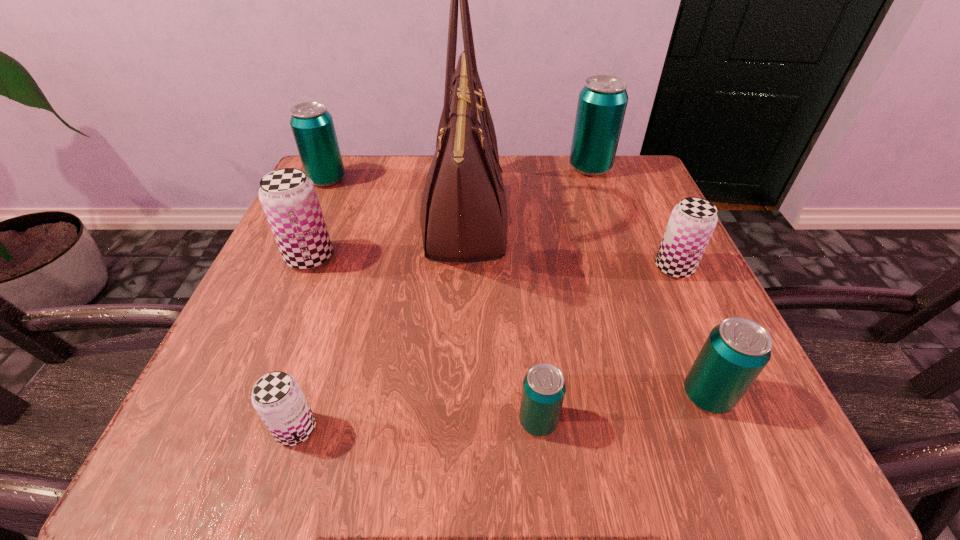
Where is `the fourth beer can from right to left`? Image resolution: width=960 pixels, height=540 pixels. the fourth beer can from right to left is located at coordinates (543, 391).

Locate an element on the screen. This screenshot has width=960, height=540. vacant point located on the front-facing side of the tallest object is located at coordinates (640, 220).

Where is `vacant region located on the front of the second tallest object`? The height and width of the screenshot is (540, 960). vacant region located on the front of the second tallest object is located at coordinates (631, 285).

I want to click on free space located 0.250m on the front of the third smallest teal beer can, so click(x=287, y=266).

Where is `blank space located 0.210m on the right of the leftmost purple beer can`? The width and height of the screenshot is (960, 540). blank space located 0.210m on the right of the leftmost purple beer can is located at coordinates (447, 257).

You are a GUI agent. You are given a task and a screenshot of the screen. Output one action in this format:
    pyautogui.click(x=<x>, y=<y>)
    Task: Click on the vacant area situated 0.180m on the front of the second smallest purple beer can
    This screenshot has height=540, width=960.
    Given the screenshot: What is the action you would take?
    pyautogui.click(x=721, y=369)

Identify the location of vacant position located 0.310m on the back of the second smallest teal beer can. The height and width of the screenshot is (540, 960). (641, 238).

Find the location of a particular element. This screenshot has height=540, width=960. vacant space positioned 0.070m on the left of the second purple beer can from left to right is located at coordinates (222, 429).

The image size is (960, 540). What are the coordinates of `free location located 0.120m on the right of the second teal beer can from left to right` in the screenshot? It's located at (649, 421).

Where is `handbag that is at the far edge`? handbag that is at the far edge is located at coordinates (463, 216).